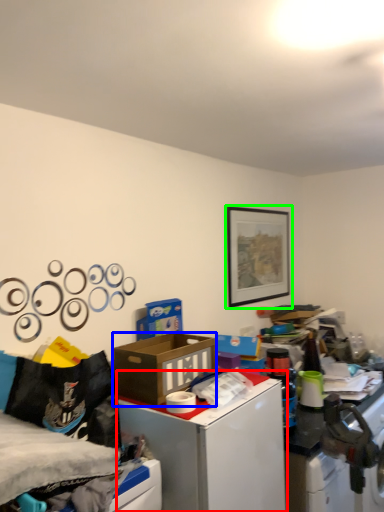
Question: Which object is positioned farthest from table (highlighted by a red box)? Select from box (highlighted by a blue box) and picture frame (highlighted by a green box).

Choices:
 (A) box
 (B) picture frame

Answer: (B)